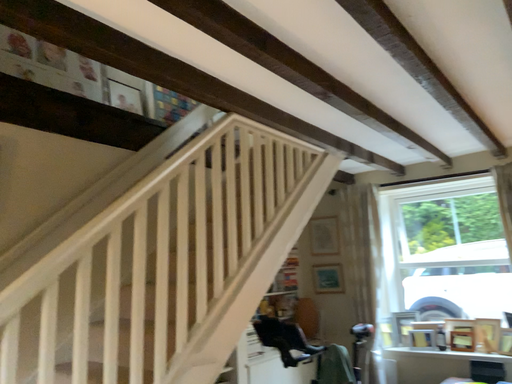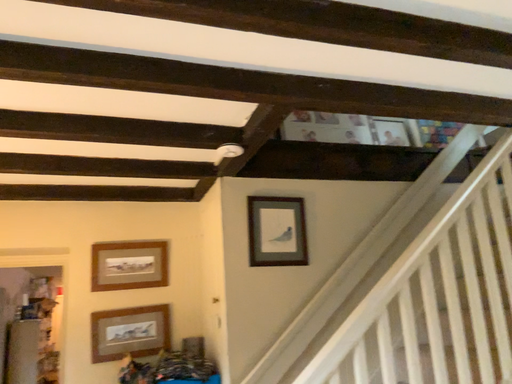
Question: Which way did the camera rotate in the video?

Choices:
 (A) rotated left
 (B) rotated right

Answer: (A)